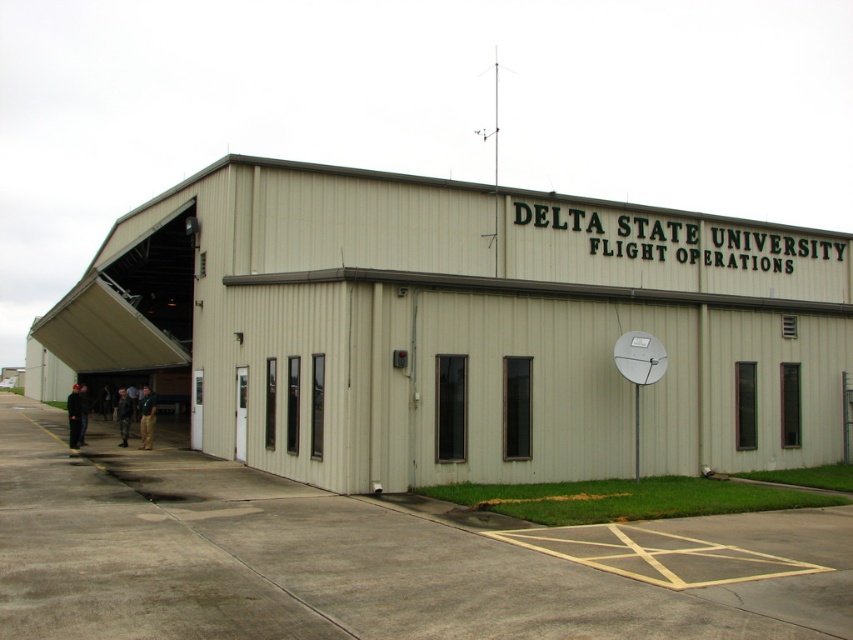
Can you confirm if beige corrugated metal hangar at center is positioned to the left of white metallic satellite dish at upper right?

Correct, you'll find beige corrugated metal hangar at center to the left of white metallic satellite dish at upper right.

Can you confirm if beige corrugated metal hangar at center is wider than white metallic satellite dish at upper right?

Yes, beige corrugated metal hangar at center is wider than white metallic satellite dish at upper right.

Is point (563, 291) positioned after point (653, 380)?

Yes, it is behind point (653, 380).

The height and width of the screenshot is (640, 853). I want to click on beige corrugated metal hangar at center, so click(461, 328).